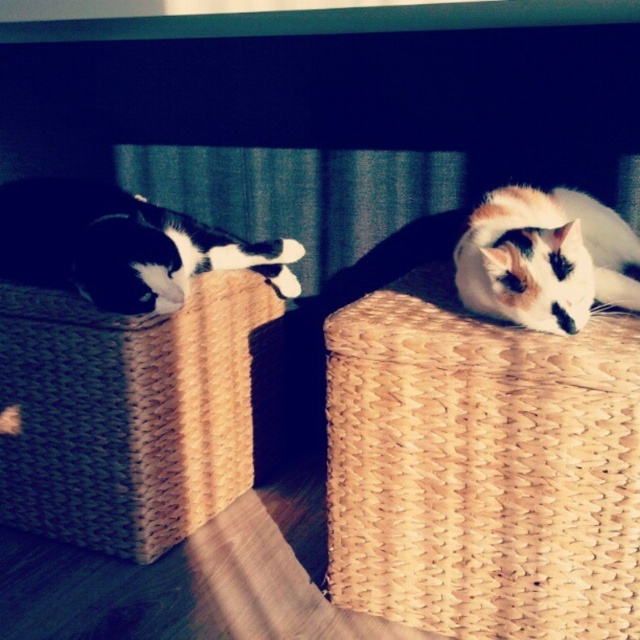
Between point (609, 516) and point (42, 209), which one is positioned behind?

Point (42, 209)

Between point (330, 346) and point (148, 211), which one is positioned in front?

Point (330, 346) is more forward.

Where is `woven straw basket at upper right`? The height and width of the screenshot is (640, 640). woven straw basket at upper right is located at coordinates (481, 468).

Does point (573, 387) come in front of point (106, 410)?

Yes, it is in front of point (106, 410).

Between point (416, 468) and point (35, 339), which one is positioned in front?

Point (416, 468) is in front.

Which is behind, point (365, 394) or point (128, 378)?

Positioned behind is point (128, 378).

Locate an element on the screen. This screenshot has width=640, height=640. woven straw basket at upper right is located at coordinates 481,468.

Who is positioned more to the right, woven straw basket at left or calico fur cat at right?

Positioned to the right is calico fur cat at right.

You are a GUI agent. You are given a task and a screenshot of the screen. Output one action in this format:
    pyautogui.click(x=<x>, y=<y>)
    Task: Click on the woven straw basket at left
    This screenshot has width=640, height=640.
    Given the screenshot: What is the action you would take?
    pyautogui.click(x=128, y=413)

Is point (209, 292) less distant than point (534, 221)?

No, it is not.

You are a GUI agent. You are given a task and a screenshot of the screen. Output one action in this format:
    pyautogui.click(x=<x>, y=<y>)
    Task: Click on the woven straw basket at left
    
    Given the screenshot: What is the action you would take?
    pyautogui.click(x=128, y=413)